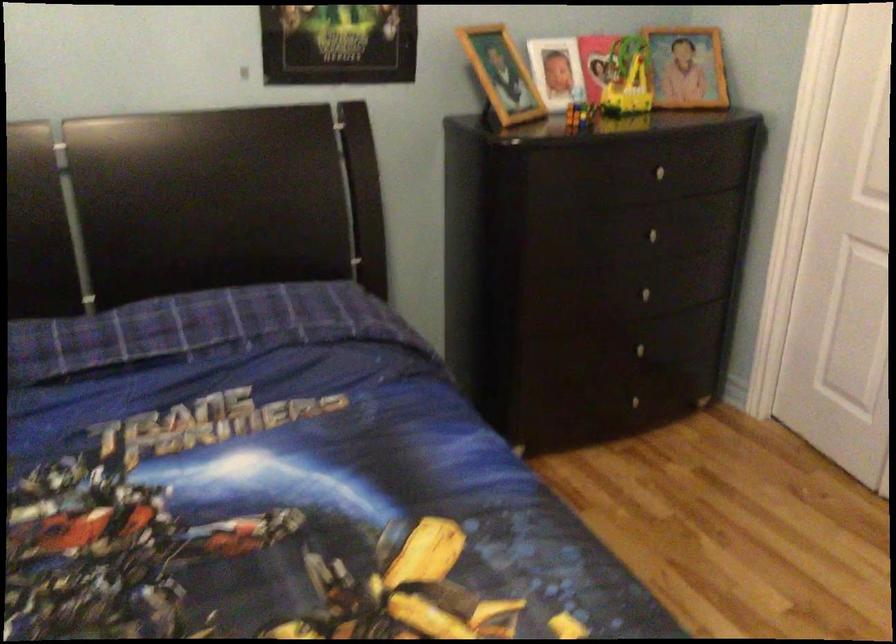
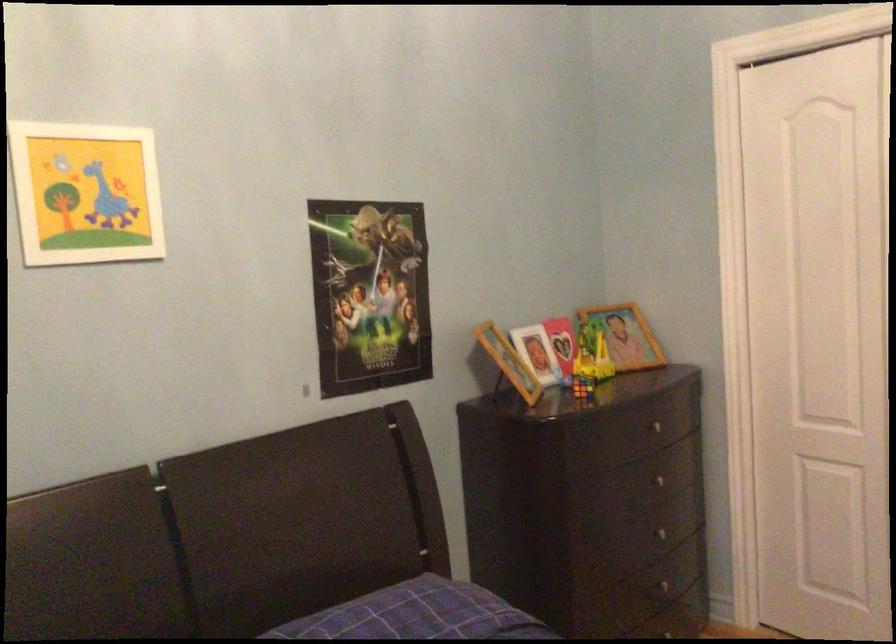
The images are taken continuously from a first-person perspective. In which direction is your viewpoint rotating?

The rotation direction of the camera is right-up.